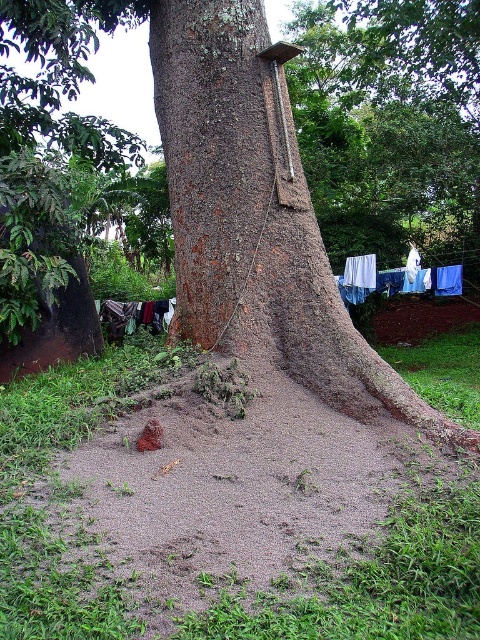
You are standing in front of the large tree trunk. You see a point marked at coordinates (x=396, y=278). What object does this point correspond to?

The point corresponds to the blue fabric clothes at lower right.

You are standing in front of the large tree trunk and want to hang a new piece of clothing on the line where the blue fabric clothes at lower right are located. Based on the coordinates provided, can you confirm if the point at (396,278) is the correct location for the clothesline?

The point at (396,278) corresponds to the blue fabric clothes at lower right, so yes, this coordinate indicates the location of the clothesline where the blue fabric clothes are hanging.

You are standing in a tropical garden and see the blue fabric clothes at lower right and the dark blue fabric at lower left. Which one is taller?

The blue fabric clothes at lower right is much taller than the dark blue fabric at lower left.